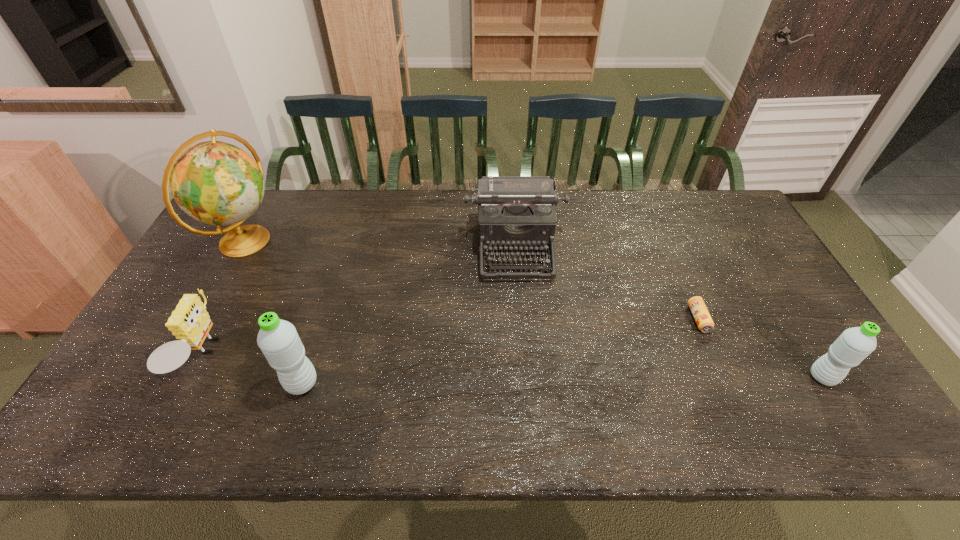
To make them evenly spaced by inserting another water_bottle among them, please locate a free space for this new water_bottle. Please provide its 2D coordinates. Your answer should be formatted as a tuple, i.e. [(x, y)], where the tuple contains the x and y coordinates of a point satisfying the conditions above.

[(564, 380)]